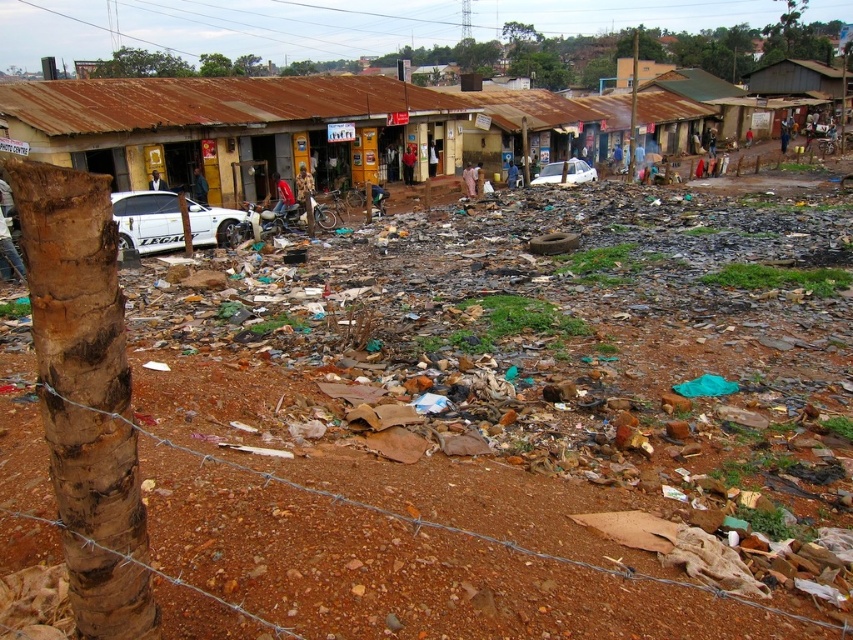
Can you confirm if rusty metal shacks at center is smaller than white matte car at center?

Actually, rusty metal shacks at center might be larger than white matte car at center.

Does rusty metal shacks at center have a greater height compared to white matte car at center?

Correct, rusty metal shacks at center is much taller as white matte car at center.

Is point (576, 106) positioned after point (577, 163)?

Yes, point (576, 106) is farther from viewer.

The image size is (853, 640). What are the coordinates of `rusty metal shacks at center` in the screenshot? It's located at (347, 112).

In the scene shown: Does rusty metal shacks at center have a lesser height compared to white matte car at left?

No.

The width and height of the screenshot is (853, 640). I want to click on rusty metal shacks at center, so click(x=347, y=112).

Locate an element on the screen. Image resolution: width=853 pixels, height=640 pixels. rusty metal shacks at center is located at coordinates (347, 112).

Is point (160, 205) farther from camera compared to point (579, 179)?

No, it is in front of (579, 179).

Is point (128, 243) in front of point (579, 163)?

Yes, point (128, 243) is closer to viewer.

Which is in front, point (212, 214) or point (540, 172)?

Point (212, 214) is more forward.

The image size is (853, 640). What are the coordinates of `white matte car at left` in the screenshot? It's located at (148, 220).